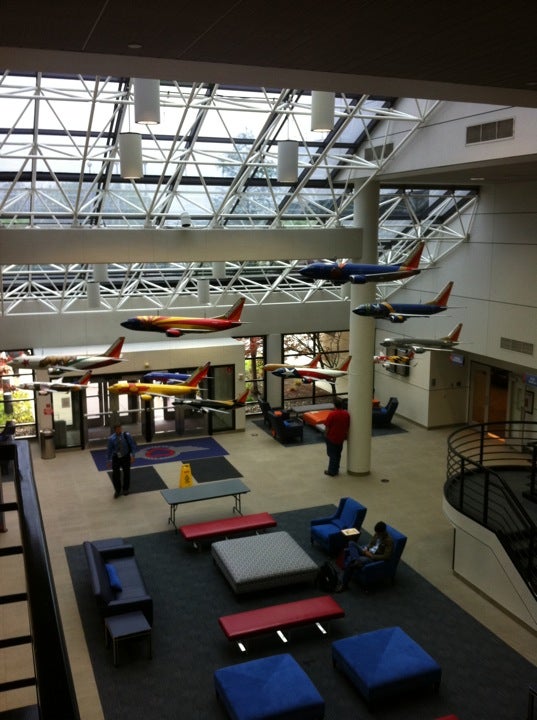
The image size is (537, 720). Identify the location of door. (93, 400), (125, 402), (165, 418), (195, 426).